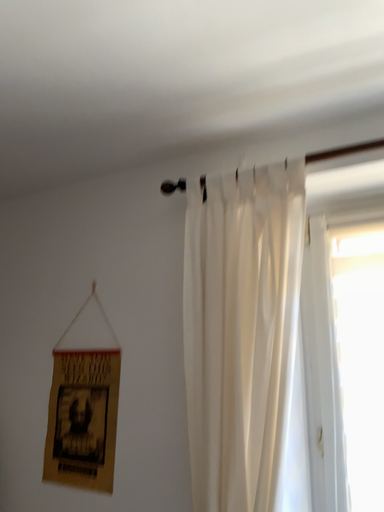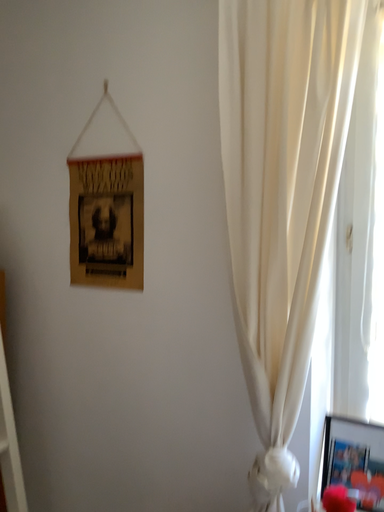
Question: Which way did the camera rotate in the video?

Choices:
 (A) rotated upward
 (B) rotated downward

Answer: (B)